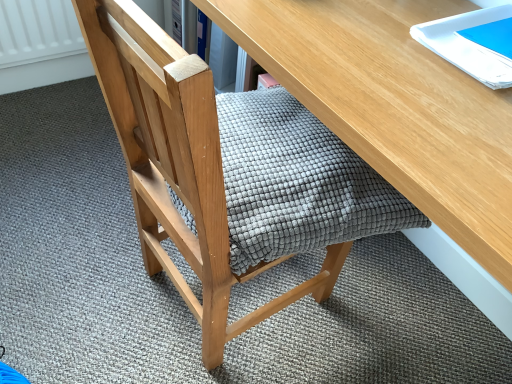
The image size is (512, 384). I want to click on vacant space in front of white glossy notebook at upper right, so click(451, 118).